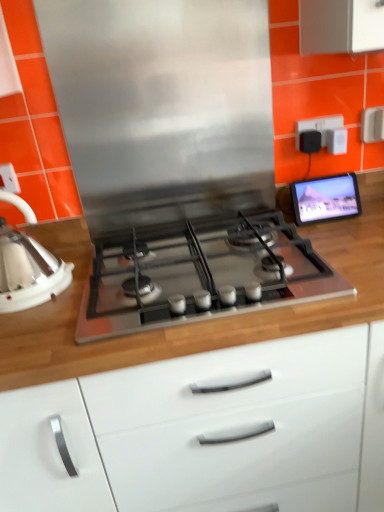
Question: Does stainless steel gas stove at center have a lesser height compared to white glossy kettle at left?

Choices:
 (A) no
 (B) yes

Answer: (B)

Question: From the image's perspective, is stainless steel gas stove at center below white glossy kettle at left?

Choices:
 (A) yes
 (B) no

Answer: (A)

Question: Does stainless steel gas stove at center appear on the left side of white glossy kettle at left?

Choices:
 (A) no
 (B) yes

Answer: (A)

Question: Could you tell me if stainless steel gas stove at center is facing white glossy kettle at left?

Choices:
 (A) no
 (B) yes

Answer: (A)

Question: From a real-world perspective, is stainless steel gas stove at center under white glossy kettle at left?

Choices:
 (A) yes
 (B) no

Answer: (A)

Question: Which is correct: black plastic outlet at upper right, positioned as the 1th electric outlet in back-to-front order, is inside white plastic electric outlet at upper left, acting as the 1th electric outlet starting from the bottom, or outside of it?

Choices:
 (A) inside
 (B) outside

Answer: (B)

Question: From a real-world perspective, is black plastic outlet at upper right, the 1th electric outlet in the top-to-bottom sequence, physically located above or below white plastic electric outlet at upper left, arranged as the second electric outlet when viewed from the right?

Choices:
 (A) above
 (B) below

Answer: (B)

Question: Considering the positions of point (299, 142) and point (0, 184), is point (299, 142) closer or farther from the camera than point (0, 184)?

Choices:
 (A) closer
 (B) farther

Answer: (B)

Question: Considering the positions of black plastic outlet at upper right, positioned as the 1th electric outlet in back-to-front order, and white plastic electric outlet at upper left, which appears as the second electric outlet when viewed from the top, in the image, is black plastic outlet at upper right, positioned as the 1th electric outlet in back-to-front order, wider or thinner than white plastic electric outlet at upper left, which appears as the second electric outlet when viewed from the top,?

Choices:
 (A) wide
 (B) thin

Answer: (B)

Question: From a real-world perspective, is stainless steel gas stove at center above or below stainless steel exhaust hood at center?

Choices:
 (A) below
 (B) above

Answer: (A)

Question: In the image, is stainless steel gas stove at center on the left side or the right side of stainless steel exhaust hood at center?

Choices:
 (A) left
 (B) right

Answer: (B)

Question: Relative to stainless steel exhaust hood at center, is stainless steel gas stove at center in front or behind?

Choices:
 (A) behind
 (B) front

Answer: (B)

Question: From the image's perspective, relative to stainless steel exhaust hood at center, is stainless steel gas stove at center above or below?

Choices:
 (A) above
 (B) below

Answer: (B)

Question: In terms of height, does matte black tablet at upper right look taller or shorter compared to wooden countertop at center?

Choices:
 (A) short
 (B) tall

Answer: (A)

Question: From the image's perspective, is matte black tablet at upper right positioned above or below wooden countertop at center?

Choices:
 (A) below
 (B) above

Answer: (B)